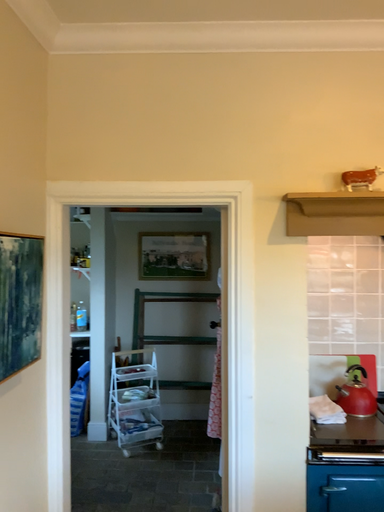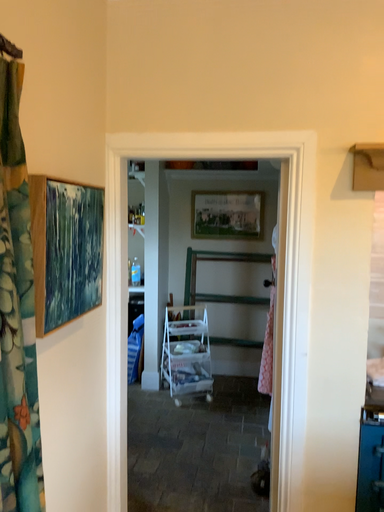
Question: Which way did the camera rotate in the video?

Choices:
 (A) rotated right
 (B) rotated left

Answer: (B)